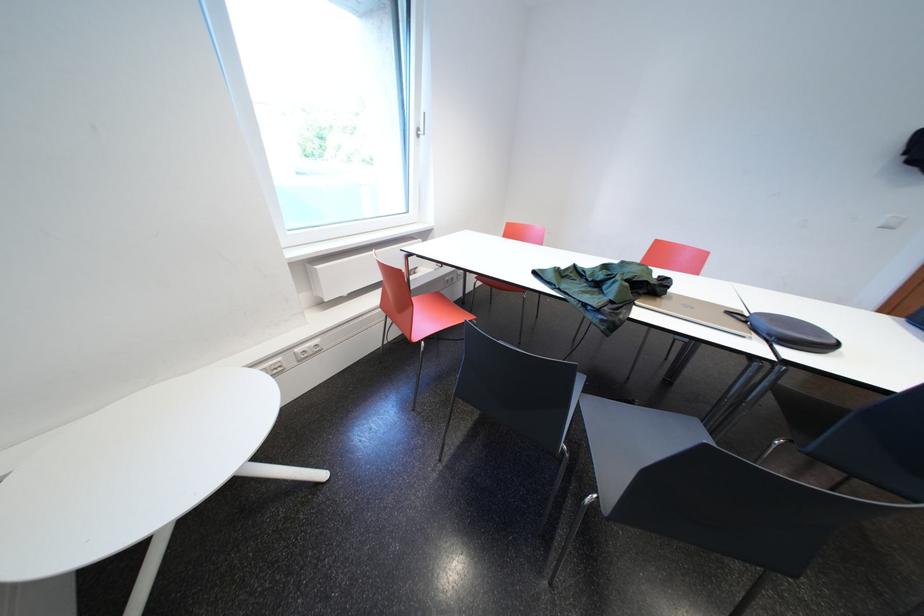
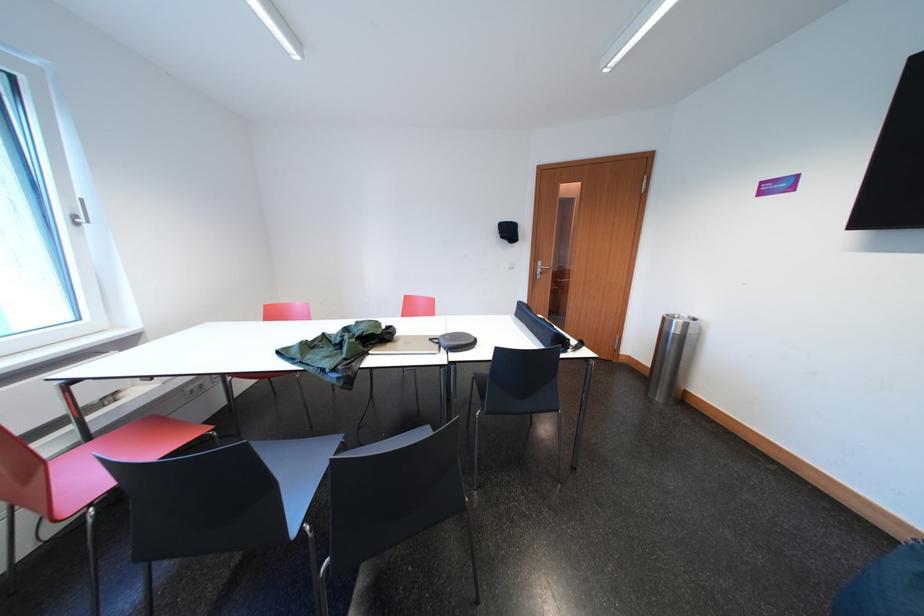
Where in the second image is the point corresponding to (429,134) from the first image?

(84, 221)